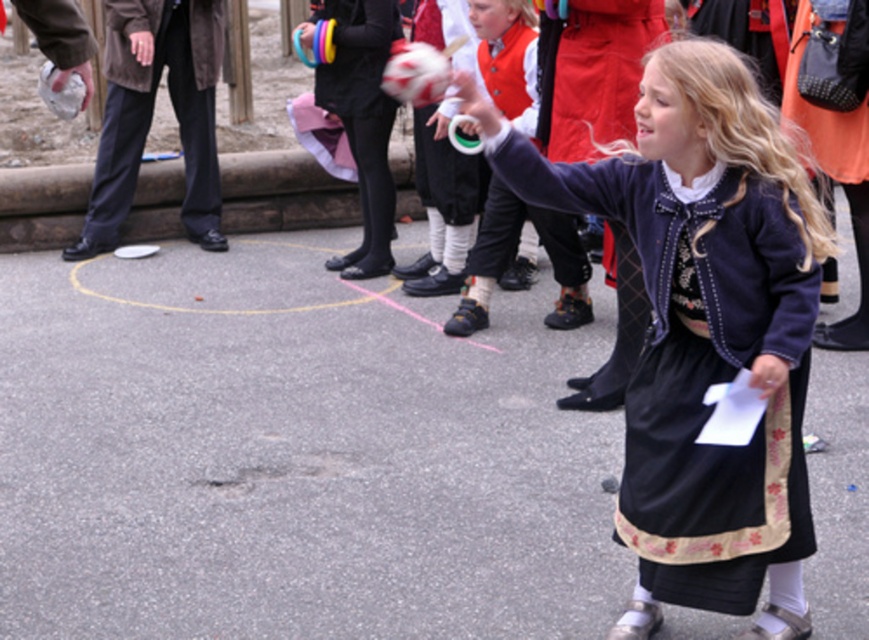
What is the color of the dress represented by the point at coordinates (x=702, y=330)?

The dress represented by the point at coordinates (x=702, y=330) is matte blue.

You are a photographer setting up for a group photo. You notice the matte blue dress at center and the matte black shoes at center. Which object should you focus on to ensure both are in frame without moving the camera? Explain your reasoning.

The matte blue dress at center is wider than the matte black shoes at center. Since the dress is wider, focusing on it would ensure both are captured in the frame as the shoes are narrower and likely within the dress width.

You are a photographer trying to capture a photo of the matte blue dress at center and the matte black shoes at center. You need to ensure both are in focus. The camera you are using has a depth of field that can cover 2 meters. Will both items be in focus?

The matte blue dress at center and the matte black shoes at center are 2.58 meters apart from each other. Since the depth of field can only cover 2 meters, the distance between them exceeds the camera settings. Therefore, both items cannot be in focus simultaneously.